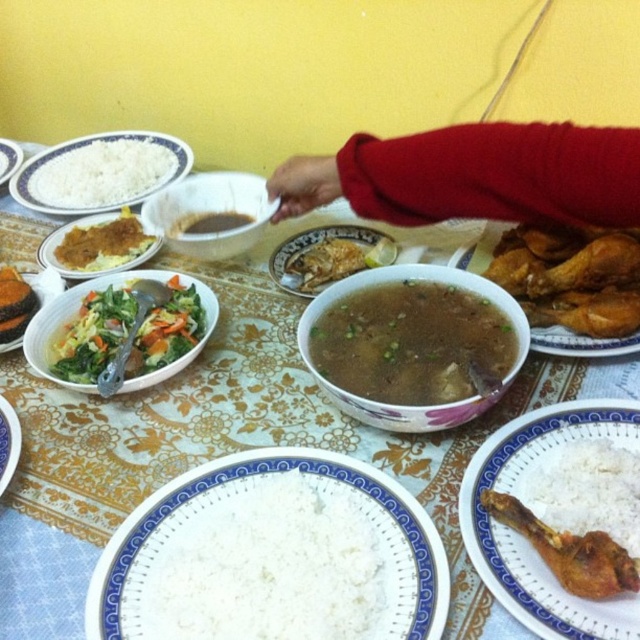
Is white glossy plate at lower right to the left of white matte plate at upper left from the viewer's perspective?

Incorrect, white glossy plate at lower right is not on the left side of white matte plate at upper left.

From the picture: Between white glossy plate at lower right and white matte plate at upper left, which one appears on the left side from the viewer's perspective?

From the viewer's perspective, white matte plate at upper left appears more on the left side.

In order to click on white glossy plate at lower right in this screenshot , I will do `click(540, 513)`.

Does white matte plate at center appear on the left side of green leafy vegetables at center?

In fact, white matte plate at center is to the right of green leafy vegetables at center.

Who is lower down, white matte plate at center or green leafy vegetables at center?

Positioned lower is white matte plate at center.

This screenshot has width=640, height=640. I want to click on white matte plate at center, so (273, 556).

Between red sweater at upper right and white matte rice at lower right, which one is positioned higher?

Positioned higher is red sweater at upper right.

Is point (444, 145) positioned before point (579, 524)?

That is False.

This screenshot has width=640, height=640. What are the coordinates of `red sweater at upper right` in the screenshot? It's located at click(x=474, y=176).